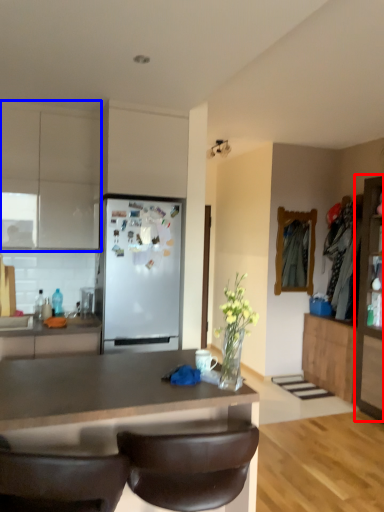
Question: Which of the following is the closest to the observer, cabinetry (highlighted by a red box) or cabinetry (highlighted by a blue box)?

Choices:
 (A) cabinetry
 (B) cabinetry

Answer: (B)